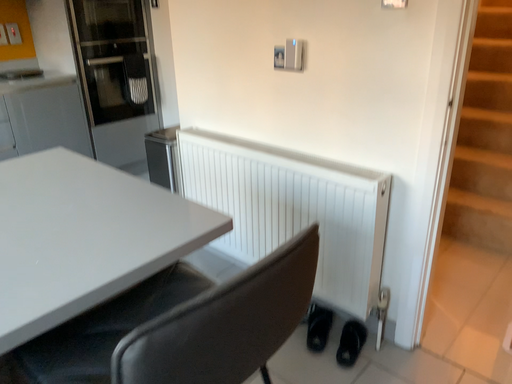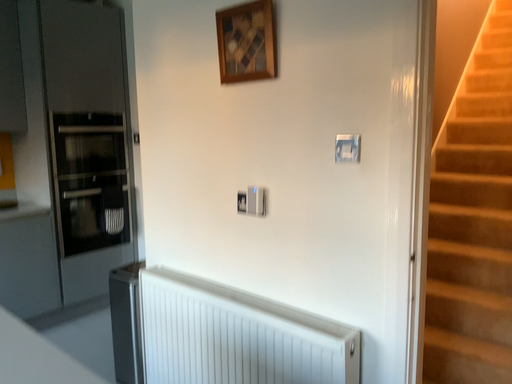
Question: How did the camera likely rotate when shooting the video?

Choices:
 (A) rotated downward
 (B) rotated upward

Answer: (B)